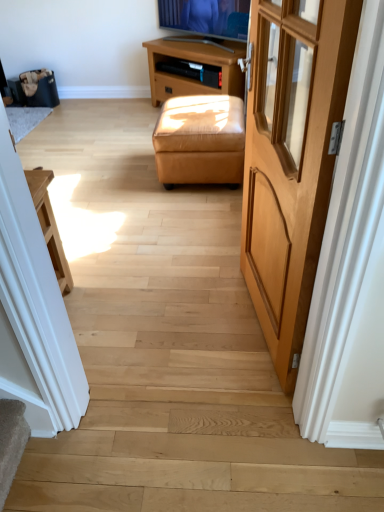
Question: From a real-world perspective, is brown wooden tv stand at upper center beneath tan leather ottoman at center?

Choices:
 (A) no
 (B) yes

Answer: (A)

Question: Is brown wooden tv stand at upper center beside tan leather ottoman at center?

Choices:
 (A) yes
 (B) no

Answer: (B)

Question: Considering the relative positions of brown wooden tv stand at upper center and tan leather ottoman at center in the image provided, is brown wooden tv stand at upper center to the right of tan leather ottoman at center from the viewer's perspective?

Choices:
 (A) no
 (B) yes

Answer: (A)

Question: From a real-world perspective, is brown wooden tv stand at upper center positioned over tan leather ottoman at center based on gravity?

Choices:
 (A) yes
 (B) no

Answer: (A)

Question: Considering the relative sizes of brown wooden tv stand at upper center and tan leather ottoman at center in the image provided, is brown wooden tv stand at upper center bigger than tan leather ottoman at center?

Choices:
 (A) yes
 (B) no

Answer: (A)

Question: Is point (271, 272) positioned closer to the camera than point (235, 62)?

Choices:
 (A) farther
 (B) closer

Answer: (B)

Question: Is light brown wood door at right to the left or to the right of brown wooden tv stand at upper center in the image?

Choices:
 (A) left
 (B) right

Answer: (B)

Question: In the image, is light brown wood door at right positioned in front of or behind brown wooden tv stand at upper center?

Choices:
 (A) front
 (B) behind

Answer: (A)

Question: Considering the positions of light brown wood door at right and brown wooden tv stand at upper center in the image, is light brown wood door at right taller or shorter than brown wooden tv stand at upper center?

Choices:
 (A) short
 (B) tall

Answer: (B)

Question: Is light brown wood door at right taller or shorter than tan leather ottoman at center?

Choices:
 (A) short
 (B) tall

Answer: (B)

Question: In terms of width, does light brown wood door at right look wider or thinner when compared to tan leather ottoman at center?

Choices:
 (A) thin
 (B) wide

Answer: (A)

Question: Is light brown wood door at right bigger or smaller than tan leather ottoman at center?

Choices:
 (A) big
 (B) small

Answer: (B)

Question: From a real-world perspective, is light brown wood door at right physically located above or below tan leather ottoman at center?

Choices:
 (A) above
 (B) below

Answer: (A)

Question: From a real-world perspective, is brown wooden tv stand at upper center above or below light brown wood door at right?

Choices:
 (A) above
 (B) below

Answer: (B)

Question: From the image's perspective, is brown wooden tv stand at upper center above or below light brown wood door at right?

Choices:
 (A) above
 (B) below

Answer: (A)